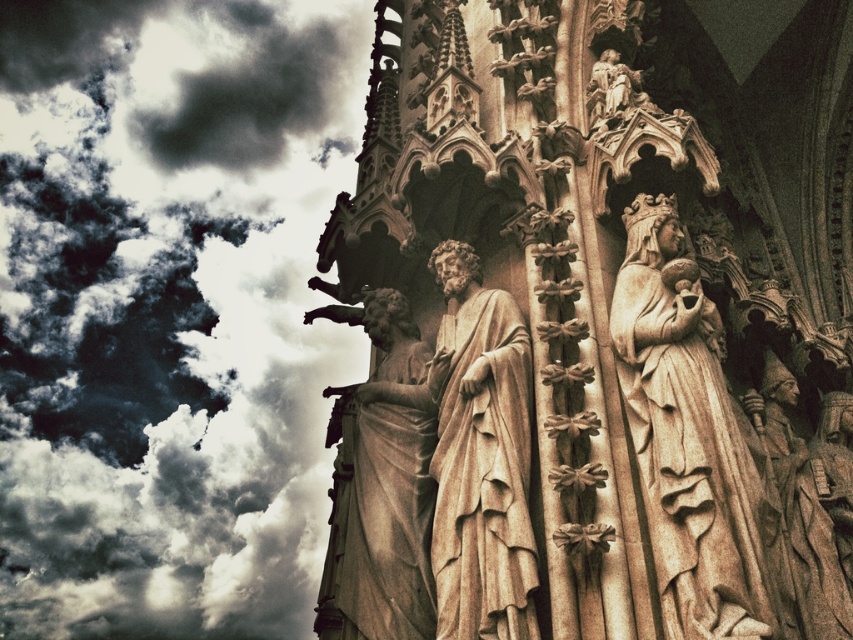
Question: Which of these objects is positioned farthest from the beige stone statue at right?

Choices:
 (A) dark gray cloud at upper left
 (B) smooth beige statue at center
 (C) beige stone statue at center

Answer: (A)

Question: Which point is farther from the camera taking this photo?

Choices:
 (A) (329, 168)
 (B) (341, 456)
 (C) (526, 612)
 (D) (676, 358)

Answer: (A)

Question: Which is farther from the smooth beige statue at center?

Choices:
 (A) beige stone statue at center
 (B) beige stone statue at right
 (C) dark gray cloud at upper left

Answer: (C)

Question: Can you confirm if beige stone statue at right is thinner than beige stone statue at center?

Choices:
 (A) no
 (B) yes

Answer: (A)

Question: Does beige stone statue at right appear over smooth beige statue at center?

Choices:
 (A) no
 (B) yes

Answer: (B)

Question: Where is dark gray cloud at upper left located in relation to beige stone statue at right in the image?

Choices:
 (A) below
 (B) above

Answer: (B)